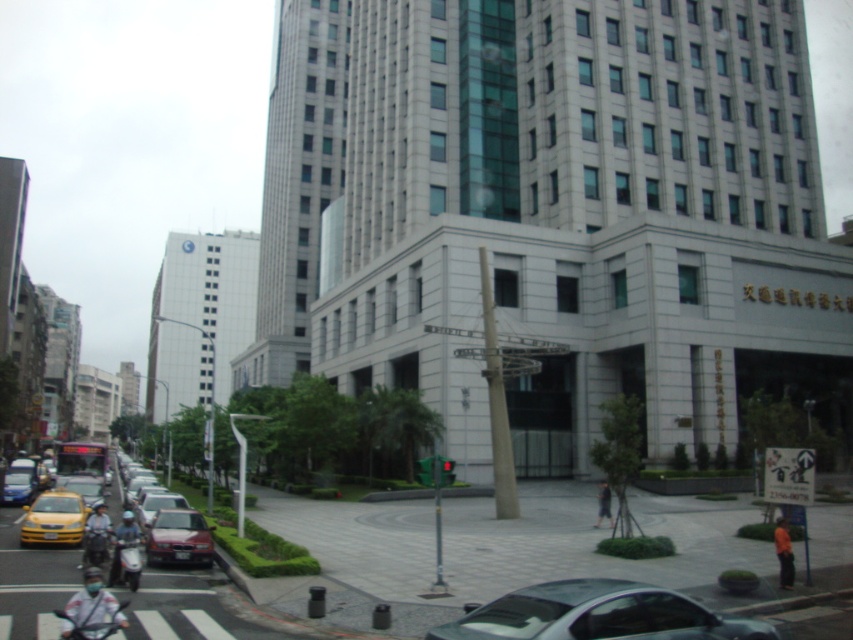
Between point (622, 596) and point (16, 504), which one is positioned behind?

Positioned behind is point (16, 504).

Where is `metallic gray car at lower center`? metallic gray car at lower center is located at coordinates (596, 614).

Which is in front, point (628, 584) or point (56, 529)?

Point (628, 584) is more forward.

Which is behind, point (611, 600) or point (51, 504)?

The point (51, 504) is behind.

The width and height of the screenshot is (853, 640). What are the coordinates of `metallic gray car at lower center` in the screenshot? It's located at (596, 614).

Is shiny red car at center shorter than matte blue sedan at lower left?

Correct, shiny red car at center is not as tall as matte blue sedan at lower left.

Does point (146, 552) come closer to viewer compared to point (20, 488)?

Yes, point (146, 552) is in front of point (20, 488).

Which is behind, point (148, 547) or point (16, 474)?

The point (16, 474) is more distant.

Find the location of a particular element. shiny red car at center is located at coordinates (178, 538).